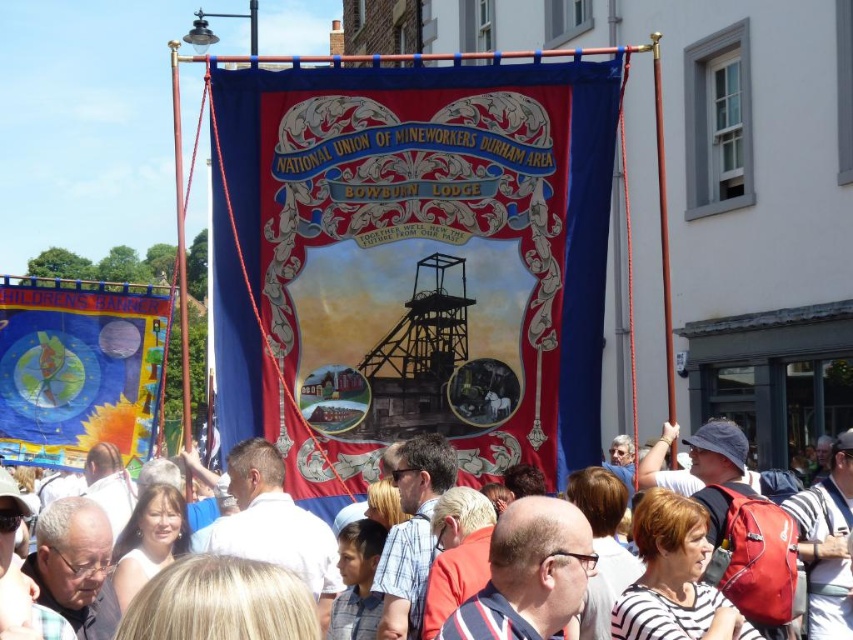
You are a photographer trying to capture both the silk banner at center and the blue fabric banner at left in a single shot. Based on their positions, which banner should you position closer to the left side of your camera frame to include both?

The blue fabric banner at left should be positioned closer to the left side of your camera frame since the silk banner at center is to the right of it.

You are a photographer standing in the crowd during the parade. You want to take a picture of the silk banner at center and the white cotton shirt at center. According to the scene, which one is positioned to the left?

The silk banner at center is positioned to the left of the white cotton shirt at center.

You are a photographer standing in the crowd watching the parade. You want to take a photo of the white cotton shirt at center without the blue fabric banner at left blocking it. Is this possible?

The blue fabric banner at left is located above the white cotton shirt at center, so it will block the view. Move to the side or angle your camera downward to avoid the banner.